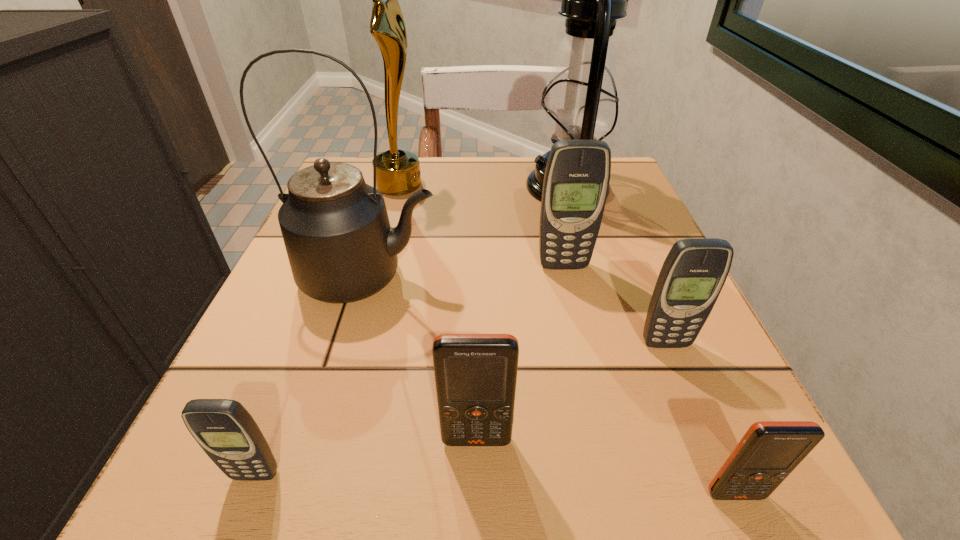
This screenshot has width=960, height=540. Identify the location of free space at the left edge of the desktop. tap(307, 362).

I want to click on vacant region at the near right corner of the desktop, so click(693, 492).

Where is `vacant space that's between the smallest gray cellular telephone and the award`? Image resolution: width=960 pixels, height=540 pixels. vacant space that's between the smallest gray cellular telephone and the award is located at coordinates click(x=327, y=329).

Find the location of a particular element. This screenshot has height=540, width=960. vacant space that is in between the award and the black oil lamp is located at coordinates (483, 185).

The width and height of the screenshot is (960, 540). What are the coordinates of `vacant region between the third tallest object and the right orange cellular telephone` in the screenshot? It's located at (552, 386).

Find the location of a particular element. This screenshot has width=960, height=540. free space between the nearest object and the rightmost gray cellular telephone is located at coordinates (700, 419).

This screenshot has height=540, width=960. Find the location of `vacant point located between the left orange cellular telephone and the kettle`. vacant point located between the left orange cellular telephone and the kettle is located at coordinates (423, 359).

This screenshot has height=540, width=960. What are the coordinates of `free space between the sixth shortest object and the nearer orange cellular telephone` in the screenshot? It's located at (552, 386).

The image size is (960, 540). I want to click on free space between the smaller orange cellular telephone and the second smallest gray cellular telephone, so tap(700, 419).

Locate an element on the screen. free space between the farther orange cellular telephone and the kettle is located at coordinates (423, 359).